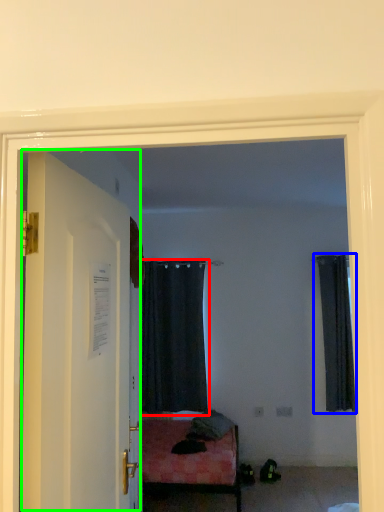
Question: Estimate the real-world distances between objects in this image. Which object is closer to curtain (highlighted by a red box), curtain (highlighted by a blue box) or door (highlighted by a green box)?

Choices:
 (A) curtain
 (B) door

Answer: (A)